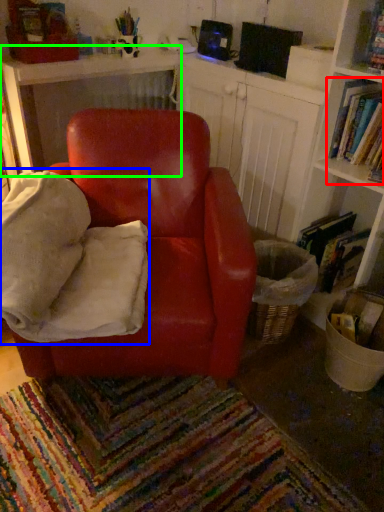
Question: Which object is positioned closest to book (highlighted by a red box)? Select from bean bag chair (highlighted by a blue box) and table (highlighted by a green box).

Choices:
 (A) bean bag chair
 (B) table

Answer: (A)